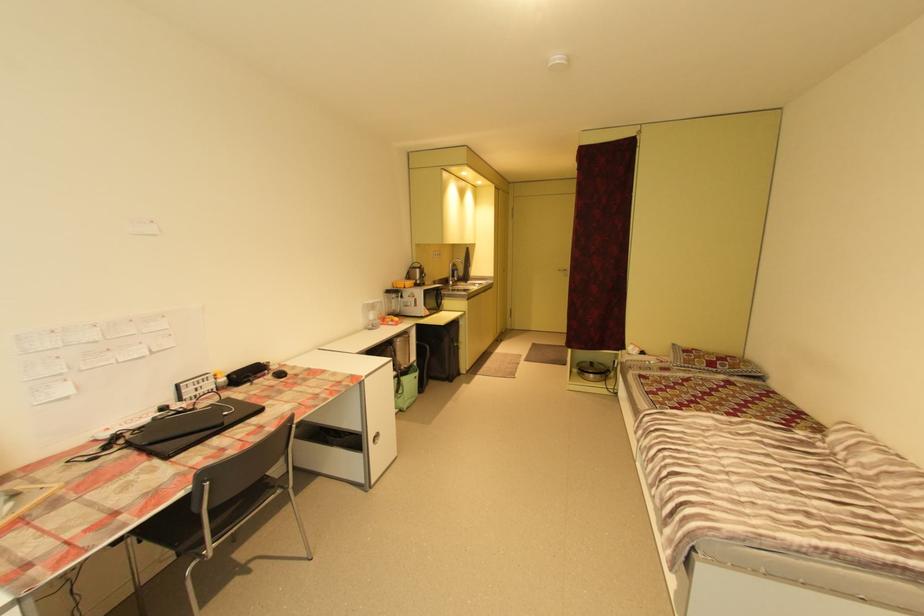
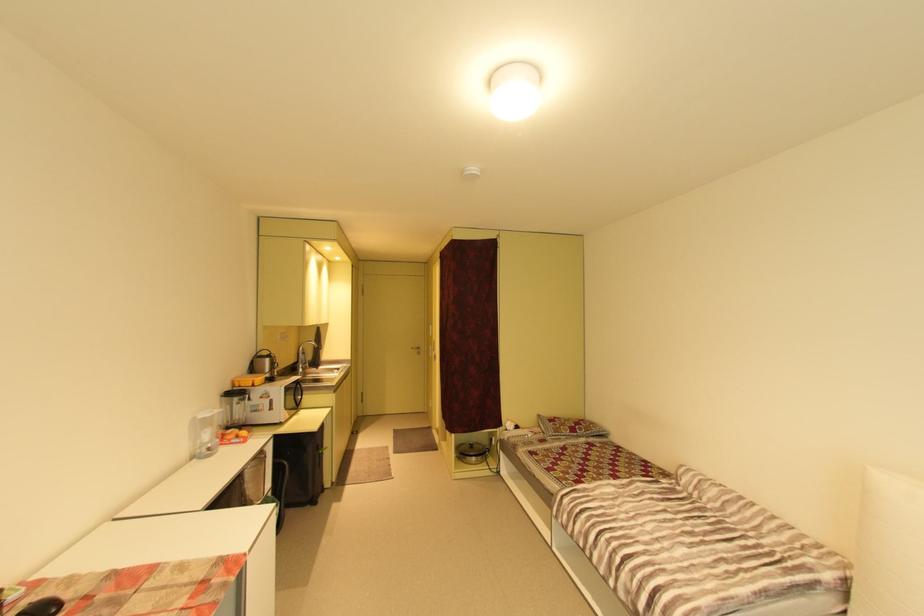
The point at [468,274] is marked in the first image. Where is the corresponding point in the second image?

(317, 358)